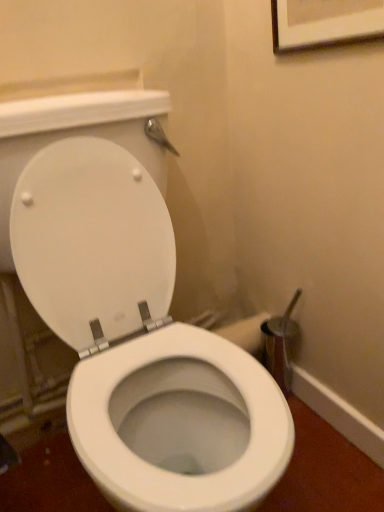
Find the location of a particular element. The height and width of the screenshot is (512, 384). white glossy toilet at center is located at coordinates (140, 341).

Describe the element at coordinates (140, 341) in the screenshot. I see `white glossy toilet at center` at that location.

What is the approximate height of wooden framed picture at upper center?

wooden framed picture at upper center is 33.51 centimeters in height.

The width and height of the screenshot is (384, 512). Describe the element at coordinates (324, 22) in the screenshot. I see `wooden framed picture at upper center` at that location.

Locate an element on the screen. wooden framed picture at upper center is located at coordinates (324, 22).

Locate an element on the screen. The image size is (384, 512). white glossy toilet at center is located at coordinates (140, 341).

Is white glossy toilet at center at the left side of wooden framed picture at upper center?

Indeed, white glossy toilet at center is positioned on the left side of wooden framed picture at upper center.

Is white glossy toilet at center in front of or behind wooden framed picture at upper center in the image?

white glossy toilet at center is in front of wooden framed picture at upper center.

Considering the positions of points (83, 392) and (371, 0), is point (83, 392) closer to camera compared to point (371, 0)?

Yes.

From the image's perspective, is white glossy toilet at center located beneath wooden framed picture at upper center?

Yes, from the image's perspective, white glossy toilet at center is below wooden framed picture at upper center.

From a real-world perspective, is white glossy toilet at center positioned above or below wooden framed picture at upper center?

In terms of real-world spatial position, white glossy toilet at center is below wooden framed picture at upper center.

In the scene shown: Considering the relative sizes of white glossy toilet at center and wooden framed picture at upper center in the image provided, is white glossy toilet at center wider than wooden framed picture at upper center?

Yes.

Considering the relative sizes of white glossy toilet at center and wooden framed picture at upper center in the image provided, is white glossy toilet at center shorter than wooden framed picture at upper center?

No.

Consider the image. Considering the relative sizes of white glossy toilet at center and wooden framed picture at upper center in the image provided, is white glossy toilet at center bigger than wooden framed picture at upper center?

Indeed, white glossy toilet at center has a larger size compared to wooden framed picture at upper center.

Would you say wooden framed picture at upper center is part of white glossy toilet at center's contents?

No.

Is white glossy toilet at center next to wooden framed picture at upper center and touching it?

No, white glossy toilet at center is not touching wooden framed picture at upper center.

Is white glossy toilet at center oriented away from wooden framed picture at upper center?

No, white glossy toilet at center is not facing the opposite direction of wooden framed picture at upper center.

Locate an element on the screen. Image resolution: width=384 pixels, height=512 pixels. picture frame that appears above the white glossy toilet at center (from a real-world perspective) is located at coordinates click(324, 22).

Which is more to the right, wooden framed picture at upper center or white glossy toilet at center?

From the viewer's perspective, wooden framed picture at upper center appears more on the right side.

Which object is closer to the camera, wooden framed picture at upper center or white glossy toilet at center?

Positioned in front is white glossy toilet at center.

Does point (361, 30) come behind point (259, 471)?

Yes, point (361, 30) is farther from viewer.

From the image's perspective, which one is positioned lower, wooden framed picture at upper center or white glossy toilet at center?

white glossy toilet at center is shown below in the image.

From a real-world perspective, which is physically below, wooden framed picture at upper center or white glossy toilet at center?

white glossy toilet at center, from a real-world perspective.

Can you confirm if wooden framed picture at upper center is thinner than white glossy toilet at center?

Yes, wooden framed picture at upper center is thinner than white glossy toilet at center.

Can you confirm if wooden framed picture at upper center is shorter than white glossy toilet at center?

Yes, wooden framed picture at upper center is shorter than white glossy toilet at center.

Considering the relative sizes of wooden framed picture at upper center and white glossy toilet at center in the image provided, is wooden framed picture at upper center bigger than white glossy toilet at center?

Incorrect, wooden framed picture at upper center is not larger than white glossy toilet at center.

Can white glossy toilet at center be found inside wooden framed picture at upper center?

That's incorrect, white glossy toilet at center is not inside wooden framed picture at upper center.

Are wooden framed picture at upper center and white glossy toilet at center located far from each other?

No, wooden framed picture at upper center is in close proximity to white glossy toilet at center.

Looking at this image, is wooden framed picture at upper center turned away from white glossy toilet at center?

No, white glossy toilet at center is not at the back of wooden framed picture at upper center.

How different are the orientations of wooden framed picture at upper center and white glossy toilet at center in degrees?

wooden framed picture at upper center and white glossy toilet at center are facing 91.2 degrees away from each other.

The image size is (384, 512). Find the location of `picture frame located above the white glossy toilet at center (from a real-world perspective)`. picture frame located above the white glossy toilet at center (from a real-world perspective) is located at coordinates (324, 22).

Where is `picture frame behind the white glossy toilet at center`? The image size is (384, 512). picture frame behind the white glossy toilet at center is located at coordinates (x=324, y=22).

At what (x,y) coordinates should I click in order to perform the action: click on toilet below the wooden framed picture at upper center (from the image's perspective). Please return your answer as a coordinate pair (x, y). This screenshot has height=512, width=384. Looking at the image, I should click on (140, 341).